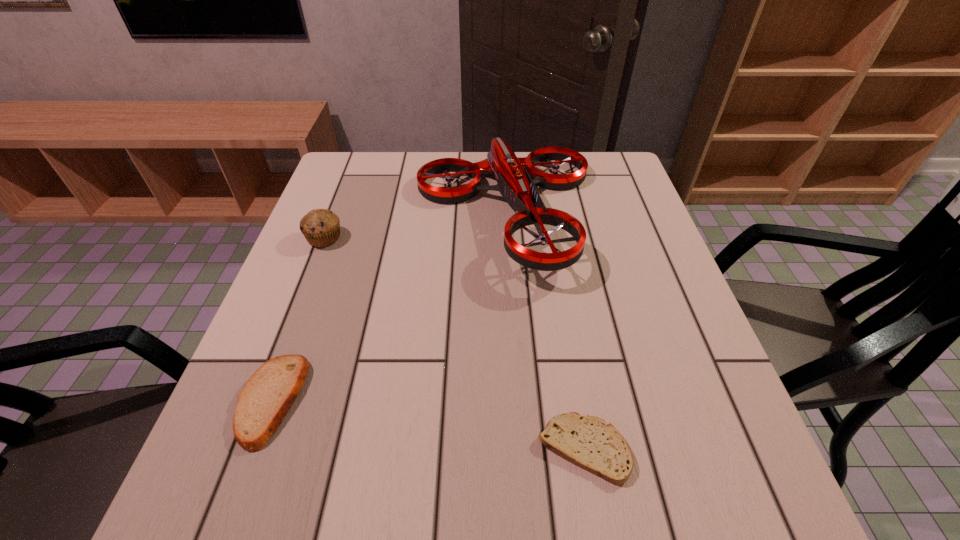
Where is `the tallest object`? This screenshot has height=540, width=960. the tallest object is located at coordinates (515, 185).

Find the location of a particular element. The width and height of the screenshot is (960, 540). the third shortest object is located at coordinates (321, 227).

This screenshot has width=960, height=540. I want to click on the left pita bread, so click(x=267, y=396).

This screenshot has height=540, width=960. Identify the location of the taller pita bread. (267, 396).

Locate an element on the screen. The width and height of the screenshot is (960, 540). the right pita bread is located at coordinates (590, 443).

Identify the location of the shortest object. The width and height of the screenshot is (960, 540). tap(590, 443).

This screenshot has height=540, width=960. What are the coordinates of `free point located on the front of the drone` in the screenshot? It's located at (519, 420).

Locate an element on the screen. free space located on the back of the muffin is located at coordinates (343, 190).

Identify the location of vacant region located 0.350m on the back of the left pita bread. (332, 238).

In order to click on vacant position located 0.080m on the left of the shorter pita bread in this screenshot , I will do `click(489, 448)`.